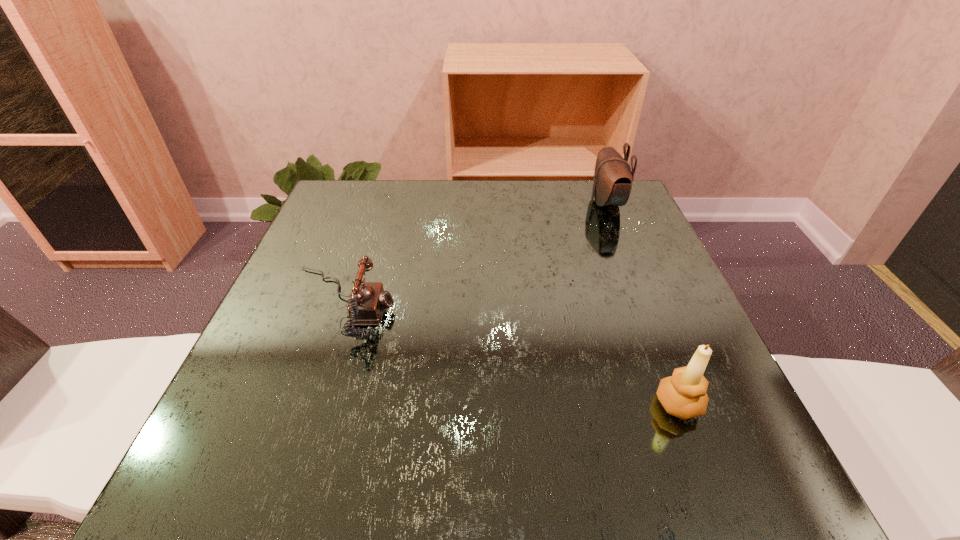
Choose which object is the nearest neighbor to the second farthest object. Please provide its 2D coordinates. Your answer should be formatted as a tuple, i.e. [(x, y)], where the tuple contains the x and y coordinates of a point satisfying the conditions above.

[(683, 395)]

Where is `object that is the second nearest to the leftmost object`? This screenshot has width=960, height=540. object that is the second nearest to the leftmost object is located at coordinates (613, 178).

Find the location of a particular element. This screenshot has height=540, width=960. vacant space that satisfies the following two spatial constraints: 1. on the back side of the nearest object; 2. on the dial of the telephone is located at coordinates (639, 303).

Find the location of a particular element. free location that satisfies the following two spatial constraints: 1. on the dial of the shortest object; 2. on the back side of the nearest object is located at coordinates (306, 404).

You are a GUI agent. You are given a task and a screenshot of the screen. Output one action in this format:
    pyautogui.click(x=<x>, y=<y>)
    Task: Click on the free space that satisfies the following two spatial constraints: 1. with the flap open on the farthest object; 2. on the front side of the candle_holder
    This screenshot has height=540, width=960.
    Given the screenshot: What is the action you would take?
    pyautogui.click(x=688, y=404)